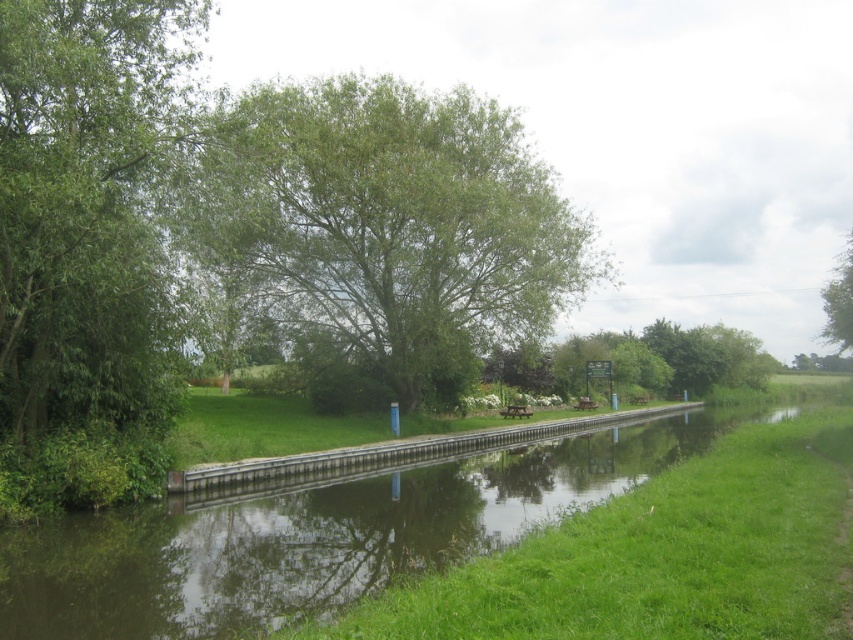
You are standing at the edge of the canal and want to take a photo of the green leafy tree at center. If your camera has a maximum zoom range of 50 feet, will you be able to capture the tree clearly without moving closer?

The green leafy tree at center is 62.33 feet away from the camera. Since the camera can only zoom up to 50 feet, you will not be able to capture the tree clearly without moving closer.

You are standing at the edge of the canal and want to throw a stone into the water. You have two target points marked as point (x=141, y=401) and point (x=850, y=416). Which point will the stone reach first if you throw it with enough force to reach both?

Point (x=141, y=401) will be reached first because it is closer to the camera compared to point (x=850, y=416).

You are standing at the right side of the canal and want to walk to the green leafy tree at left. Which direction should you go relative to the green grass at center?

You should go to the left side of the green grass at center to reach the green leafy tree at left since it is positioned on the left side of green grass at center.